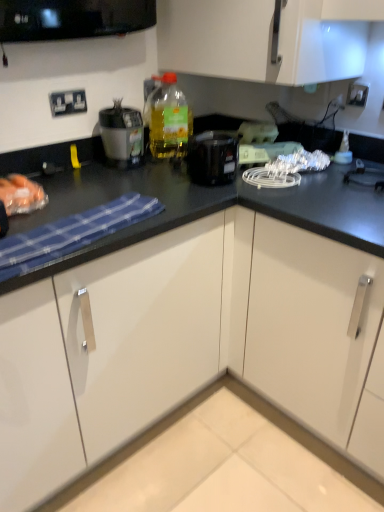
Image resolution: width=384 pixels, height=512 pixels. In order to click on blank space situated above white glossy cabinet at lower center (from a real-world perspective) in this screenshot , I will do `click(214, 458)`.